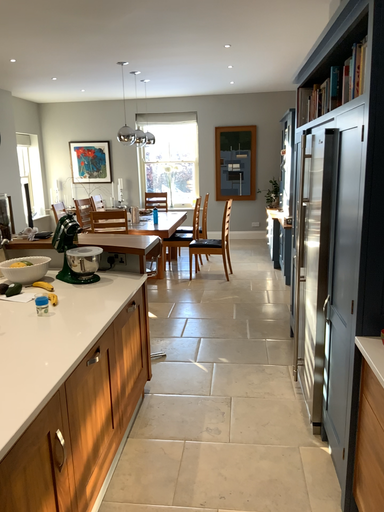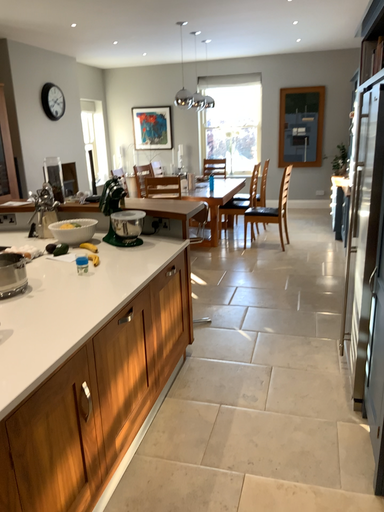
Question: Which way did the camera rotate in the video?

Choices:
 (A) rotated right
 (B) rotated left

Answer: (B)